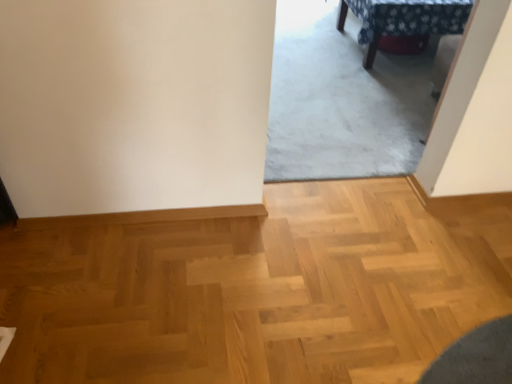
The width and height of the screenshot is (512, 384). What do you see at coordinates (403, 19) in the screenshot?
I see `patterned fabric table at upper right` at bounding box center [403, 19].

Where is `patterned fabric table at upper right`? The image size is (512, 384). patterned fabric table at upper right is located at coordinates (403, 19).

Image resolution: width=512 pixels, height=384 pixels. What are the coordinates of `patterned fabric table at upper right` in the screenshot? It's located at (403, 19).